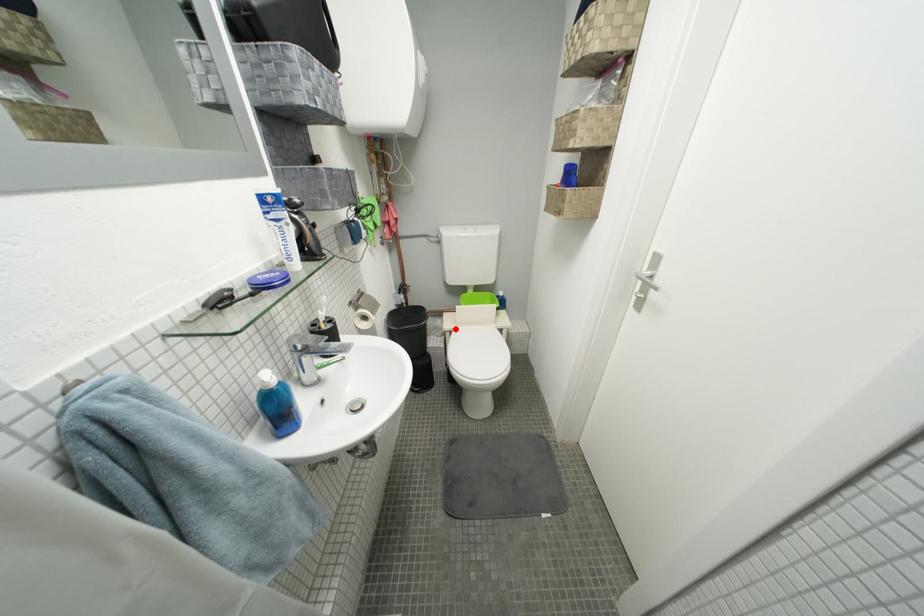
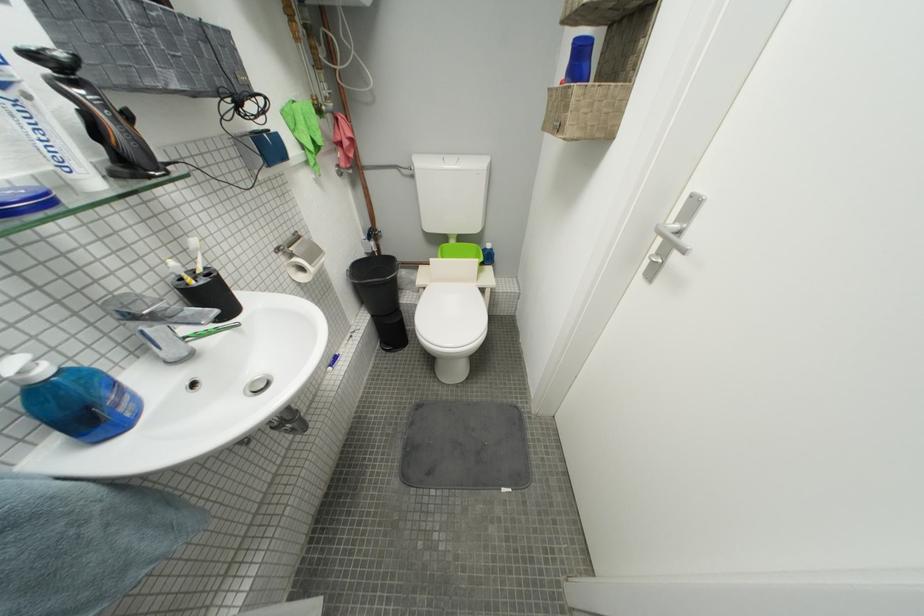
Where in the second image is the point corresponding to the highlighted location from the first image?

(429, 284)